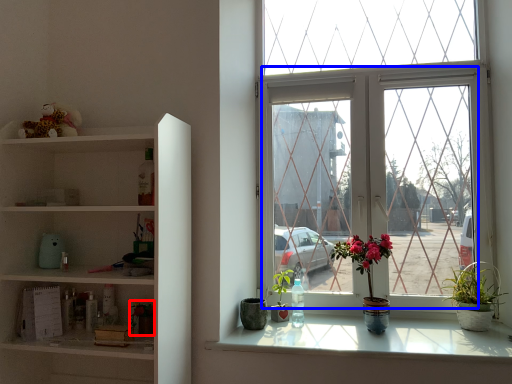
Question: Among these objects, which one is farthest to the camera, houseplant (highlighted by a red box) or glass window (highlighted by a blue box)?

Choices:
 (A) houseplant
 (B) glass window

Answer: (B)